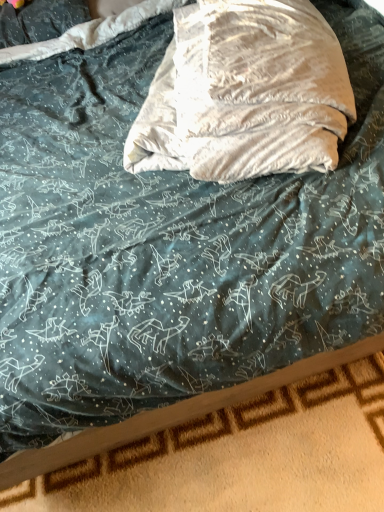
I want to click on free space above wooden bed frame at bottom (from a real-world perspective), so click(232, 459).